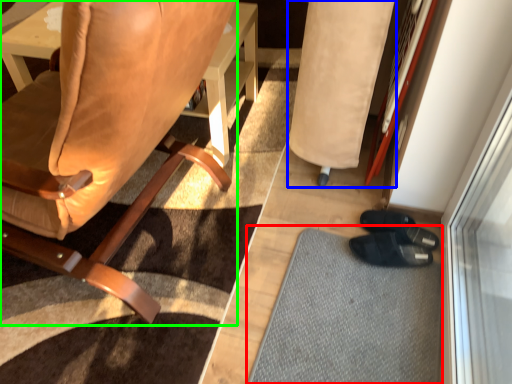
Question: Which object is the closest to the doormat (highlighted by a red box)? Choose among these: bean bag chair (highlighted by a blue box) or chair (highlighted by a green box).

Choices:
 (A) bean bag chair
 (B) chair

Answer: (A)